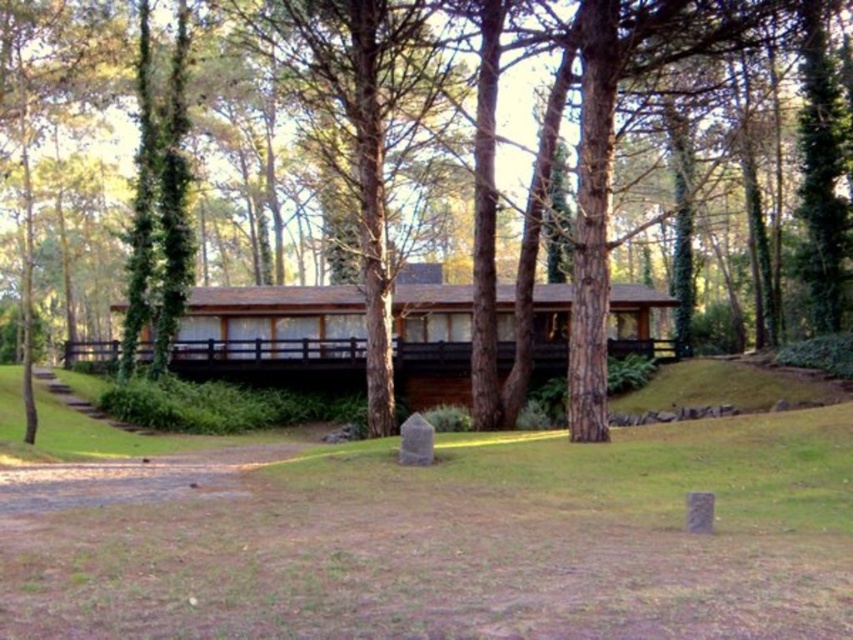
Based on the photo, who is positioned more to the left, green grass at center or brown wood tree at center?

brown wood tree at center

Which is in front, point (282, 488) or point (347, 372)?

Point (282, 488) is in front.

The width and height of the screenshot is (853, 640). I want to click on green grass at center, so click(x=437, y=536).